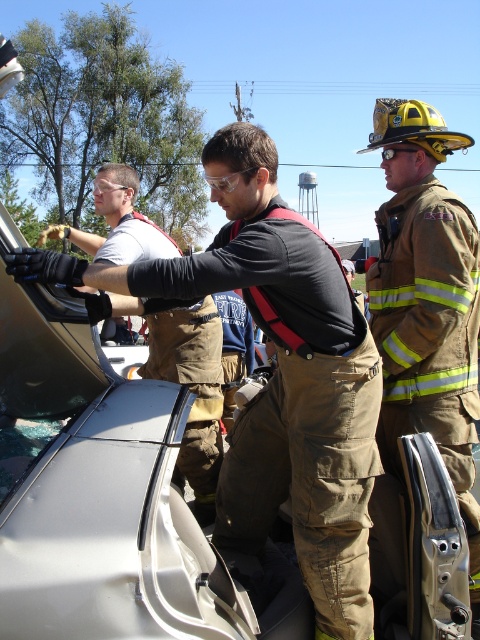
Which is below, brown/canvas jumpsuit at center or transparent glass car window at lower left?

Positioned lower is brown/canvas jumpsuit at center.

Is point (248, 472) positioned after point (66, 298)?

Yes, it is.

This screenshot has width=480, height=640. I want to click on brown/canvas jumpsuit at center, so click(276, 376).